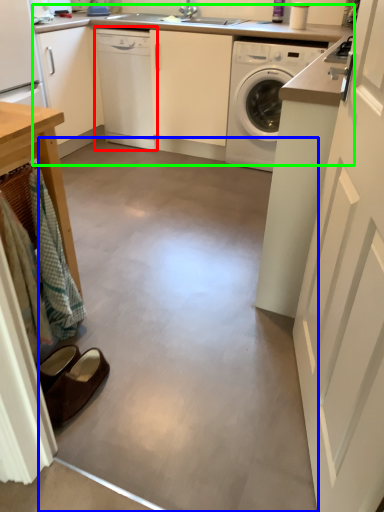
Question: Estimate the real-world distances between objects in this image. Which object is closer to dishwasher (highlighted by a red box), concrete (highlighted by a blue box) or counter top (highlighted by a green box)?

Choices:
 (A) concrete
 (B) counter top

Answer: (B)